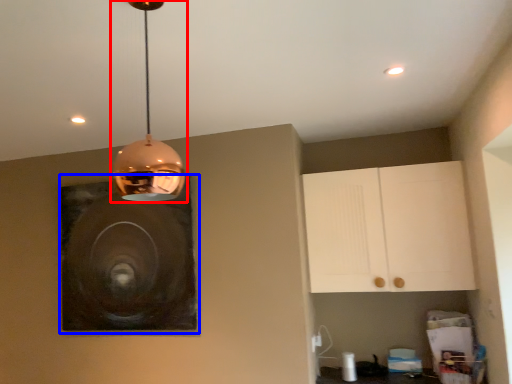
Question: Which object appears closest to the camera in this image, lamp (highlighted by a red box) or picture frame (highlighted by a blue box)?

Choices:
 (A) lamp
 (B) picture frame

Answer: (A)